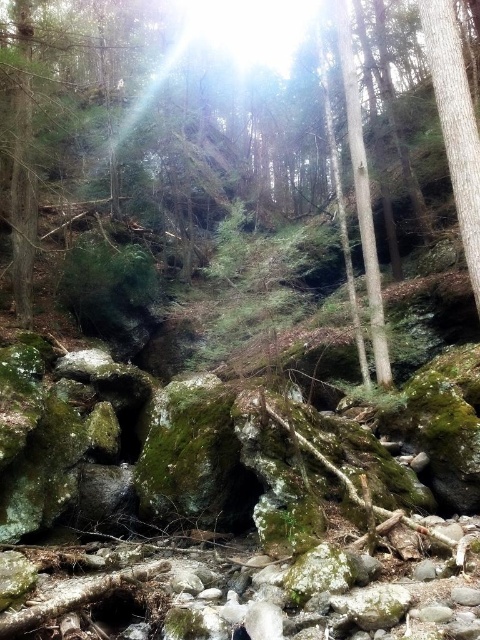
Question: Which of the following is the farthest from the observer?

Choices:
 (A) green mossy rock at center
 (B) smooth bark tree at right

Answer: (B)

Question: Which point is farther to the camera?

Choices:
 (A) (456, 54)
 (B) (210, 118)

Answer: (B)

Question: Is green mossy rock at center positioned at the back of smooth bark tree at right?

Choices:
 (A) no
 (B) yes

Answer: (A)

Question: Among these objects, which one is farthest from the camera?

Choices:
 (A) smooth bark tree at right
 (B) green mossy rock at center

Answer: (A)

Question: Does green mossy rock at center lie behind smooth bark tree at right?

Choices:
 (A) yes
 (B) no

Answer: (B)

Question: Is green mossy rock at center wider than smooth bark tree at right?

Choices:
 (A) yes
 (B) no

Answer: (A)